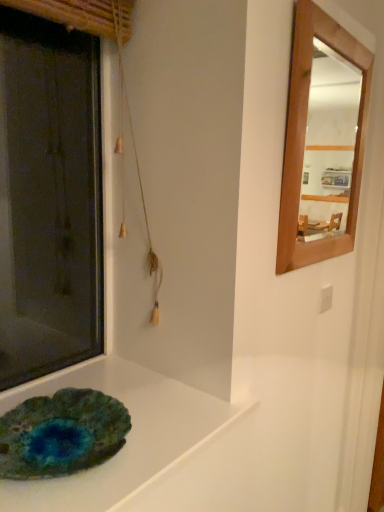
At what (x,y) coordinates should I click in order to perform the action: click on teal agate plate at lower left. Please return your answer as a coordinate pair (x, y). This screenshot has height=512, width=384. Looking at the image, I should click on (61, 434).

The image size is (384, 512). What do you see at coordinates (61, 434) in the screenshot?
I see `teal agate plate at lower left` at bounding box center [61, 434].

The height and width of the screenshot is (512, 384). Describe the element at coordinates (126, 436) in the screenshot. I see `matte stone slab at lower left` at that location.

The image size is (384, 512). Find the location of `matte stone slab at lower left`. matte stone slab at lower left is located at coordinates (126, 436).

The width and height of the screenshot is (384, 512). Find the location of `teal agate plate at lower left`. teal agate plate at lower left is located at coordinates (61, 434).

Based on the photo, can you confirm if teal agate plate at lower left is positioned to the left of matte stone slab at lower left?

Yes, teal agate plate at lower left is to the left of matte stone slab at lower left.

Relative to matte stone slab at lower left, is teal agate plate at lower left in front or behind?

teal agate plate at lower left is behind matte stone slab at lower left.

Considering the positions of point (102, 431) and point (156, 478), is point (102, 431) closer or farther from the camera than point (156, 478)?

Point (102, 431) is farther from the camera than point (156, 478).

From the image's perspective, is teal agate plate at lower left located above matte stone slab at lower left?

Yes, from the image's perspective, teal agate plate at lower left is on top of matte stone slab at lower left.

From a real-world perspective, between teal agate plate at lower left and matte stone slab at lower left, who is vertically lower?

From a 3D spatial view, matte stone slab at lower left is below.

Can you confirm if teal agate plate at lower left is wider than matte stone slab at lower left?

No.

In terms of height, does teal agate plate at lower left look taller or shorter compared to matte stone slab at lower left?

Clearly, teal agate plate at lower left is taller compared to matte stone slab at lower left.

Is teal agate plate at lower left bigger or smaller than matte stone slab at lower left?

Considering their sizes, teal agate plate at lower left takes up less space than matte stone slab at lower left.

Looking at this image, is teal agate plate at lower left positioned beyond the bounds of matte stone slab at lower left?

Absolutely, teal agate plate at lower left is external to matte stone slab at lower left.

Does teal agate plate at lower left touch matte stone slab at lower left?

Yes, teal agate plate at lower left is beside matte stone slab at lower left.

Is teal agate plate at lower left positioned with its back to matte stone slab at lower left?

teal agate plate at lower left is not turned away from matte stone slab at lower left.

What's the angular difference between teal agate plate at lower left and matte stone slab at lower left's facing directions?

0.551 degrees separate the facing orientations of teal agate plate at lower left and matte stone slab at lower left.

This screenshot has height=512, width=384. What are the coordinates of `counter top in front of the teal agate plate at lower left` in the screenshot? It's located at (126, 436).

Can you confirm if matte stone slab at lower left is positioned to the right of teal agate plate at lower left?

Indeed, matte stone slab at lower left is positioned on the right side of teal agate plate at lower left.

Who is more distant, matte stone slab at lower left or teal agate plate at lower left?

teal agate plate at lower left is further from the camera.

Does point (140, 386) come in front of point (44, 431)?

No, (140, 386) is further to viewer.

From the image's perspective, which is below, matte stone slab at lower left or teal agate plate at lower left?

matte stone slab at lower left.

From a real-world perspective, is matte stone slab at lower left physically above teal agate plate at lower left?

No, from a real-world perspective, matte stone slab at lower left is not over teal agate plate at lower left

Considering the sizes of matte stone slab at lower left and teal agate plate at lower left in the image, is matte stone slab at lower left wider or thinner than teal agate plate at lower left?

matte stone slab at lower left is wider than teal agate plate at lower left.

In terms of height, does matte stone slab at lower left look taller or shorter compared to teal agate plate at lower left?

In the image, matte stone slab at lower left appears to be shorter than teal agate plate at lower left.

Between matte stone slab at lower left and teal agate plate at lower left, which one has larger size?

Bigger between the two is matte stone slab at lower left.

Do you think matte stone slab at lower left is within teal agate plate at lower left, or outside of it?

matte stone slab at lower left is located beyond the bounds of teal agate plate at lower left.

Is matte stone slab at lower left with teal agate plate at lower left?

Yes, matte stone slab at lower left is right next to teal agate plate at lower left and making contact.

Is matte stone slab at lower left facing towards teal agate plate at lower left?

No, matte stone slab at lower left is not facing towards teal agate plate at lower left.

How far apart are matte stone slab at lower left and teal agate plate at lower left?

matte stone slab at lower left and teal agate plate at lower left are 9.07 centimeters apart.

The image size is (384, 512). I want to click on counter top to the right of teal agate plate at lower left, so click(x=126, y=436).

Image resolution: width=384 pixels, height=512 pixels. I want to click on counter top that appears below the teal agate plate at lower left (from the image's perspective), so click(x=126, y=436).

At what (x,y) coordinates should I click in order to perform the action: click on counter top directly beneath the teal agate plate at lower left (from a real-world perspective). Please return your answer as a coordinate pair (x, y). This screenshot has height=512, width=384. Looking at the image, I should click on (126, 436).